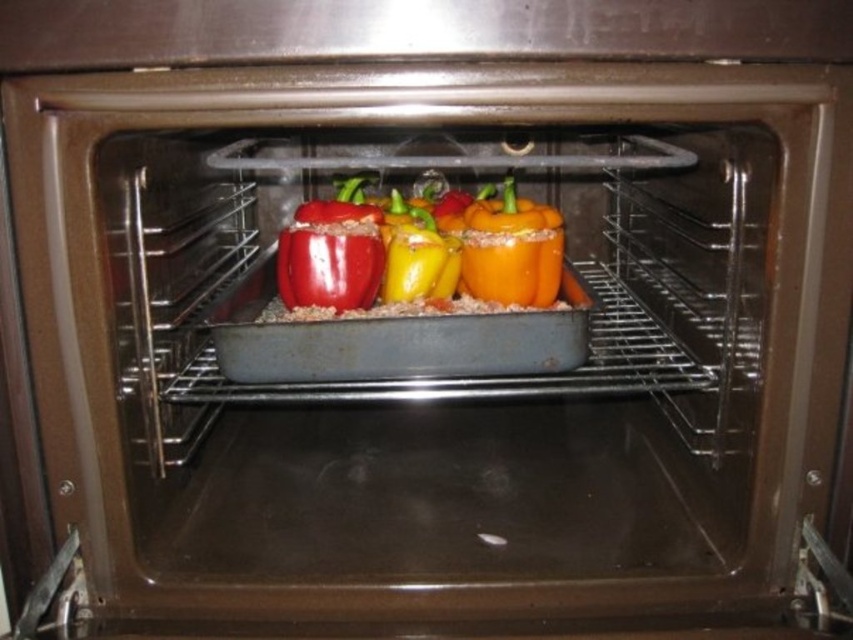
Which is in front, point (520, 218) or point (463, 237)?

Point (520, 218)

Can you confirm if shiny red bell pepper at center is bigger than orange matte bell pepper at center?

Correct, shiny red bell pepper at center is larger in size than orange matte bell pepper at center.

Who is more forward, (396,198) or (538,257)?

Point (538,257)

Locate an element on the screen. The image size is (853, 640). shiny red bell pepper at center is located at coordinates [x=428, y=252].